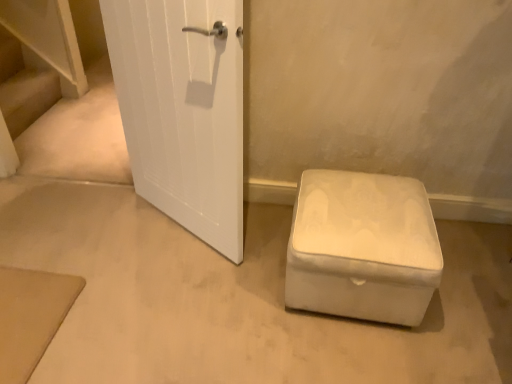
Question: Would you say white fabric ottoman at lower right contains wooden stairs at left?

Choices:
 (A) yes
 (B) no

Answer: (B)

Question: Considering the relative sizes of white fabric ottoman at lower right and wooden stairs at left in the image provided, is white fabric ottoman at lower right taller than wooden stairs at left?

Choices:
 (A) no
 (B) yes

Answer: (B)

Question: Is white fabric ottoman at lower right oriented towards wooden stairs at left?

Choices:
 (A) no
 (B) yes

Answer: (A)

Question: From a real-world perspective, is white fabric ottoman at lower right below wooden stairs at left?

Choices:
 (A) no
 (B) yes

Answer: (A)

Question: Is white fabric ottoman at lower right at the left side of wooden stairs at left?

Choices:
 (A) yes
 (B) no

Answer: (B)

Question: Is the surface of white fabric ottoman at lower right in direct contact with wooden stairs at left?

Choices:
 (A) no
 (B) yes

Answer: (A)

Question: Is the depth of wooden stairs at left greater than that of white fabric ottoman at lower right?

Choices:
 (A) yes
 (B) no

Answer: (A)

Question: Does wooden stairs at left have a lesser width compared to white fabric ottoman at lower right?

Choices:
 (A) no
 (B) yes

Answer: (B)

Question: Can we say wooden stairs at left lies outside white fabric ottoman at lower right?

Choices:
 (A) no
 (B) yes

Answer: (B)

Question: Would you say white fabric ottoman at lower right is part of wooden stairs at left's contents?

Choices:
 (A) yes
 (B) no

Answer: (B)

Question: Considering the relative positions of wooden stairs at left and white fabric ottoman at lower right in the image provided, is wooden stairs at left to the left of white fabric ottoman at lower right from the viewer's perspective?

Choices:
 (A) no
 (B) yes

Answer: (B)

Question: From a real-world perspective, is wooden stairs at left under white fabric ottoman at lower right?

Choices:
 (A) yes
 (B) no

Answer: (A)

Question: Considering the positions of point click(x=414, y=213) and point click(x=10, y=130), is point click(x=414, y=213) closer or farther from the camera than point click(x=10, y=130)?

Choices:
 (A) farther
 (B) closer

Answer: (B)